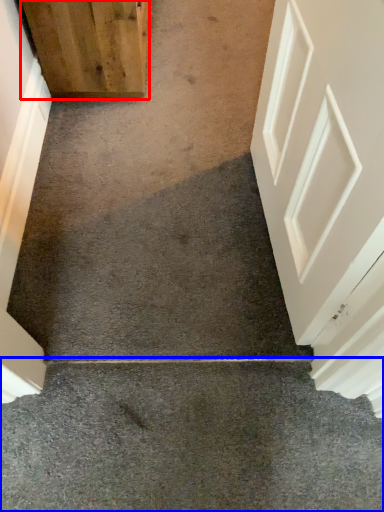
Question: Which point is closer to the camera, door (highlighted by a red box) or concrete (highlighted by a blue box)?

Choices:
 (A) door
 (B) concrete

Answer: (B)